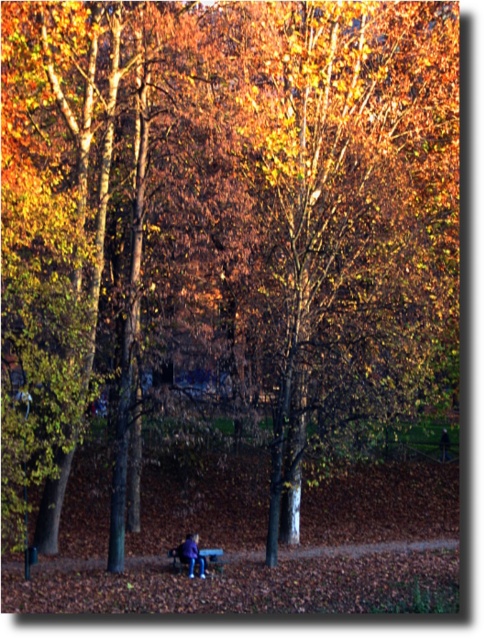
Who is positioned more to the left, golden-brown bark tree at center or blue denim jeans at lower center?

blue denim jeans at lower center is more to the left.

Does golden-brown bark tree at center have a greater width compared to blue denim jeans at lower center?

Indeed, golden-brown bark tree at center has a greater width compared to blue denim jeans at lower center.

Identify the location of golden-brown bark tree at center. (353, 218).

Is point (173, 566) farther from viewer compared to point (200, 554)?

Yes, it is behind point (200, 554).

Between wooden park bench at lower center and blue denim jeans at lower center, which one has more height?

Standing taller between the two is blue denim jeans at lower center.

What do you see at coordinates (211, 560) in the screenshot? The image size is (486, 640). I see `wooden park bench at lower center` at bounding box center [211, 560].

This screenshot has height=640, width=486. Find the location of `wooden park bench at lower center`. wooden park bench at lower center is located at coordinates (211, 560).

Is golden-brown bark tree at center further to camera compared to wooden park bench at lower center?

No, it is not.

Does golden-brown bark tree at center have a larger size compared to wooden park bench at lower center?

Yes.

At what (x,y) coordinates should I click in order to perform the action: click on golden-brown bark tree at center. Please return your answer as a coordinate pair (x, y). This screenshot has width=486, height=640. Looking at the image, I should click on (353, 218).